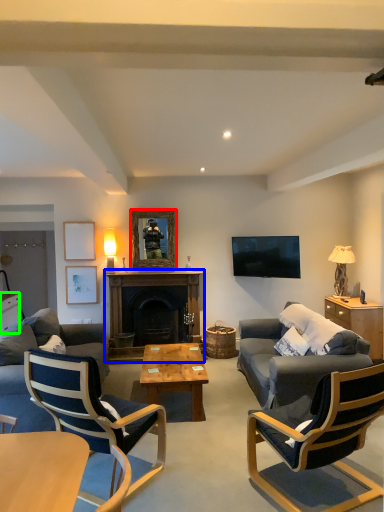
Question: Which object is positioned farthest from mirror (highlighted by a red box)? Select from fireplace (highlighted by a blue box) and cabinetry (highlighted by a green box).

Choices:
 (A) fireplace
 (B) cabinetry

Answer: (B)